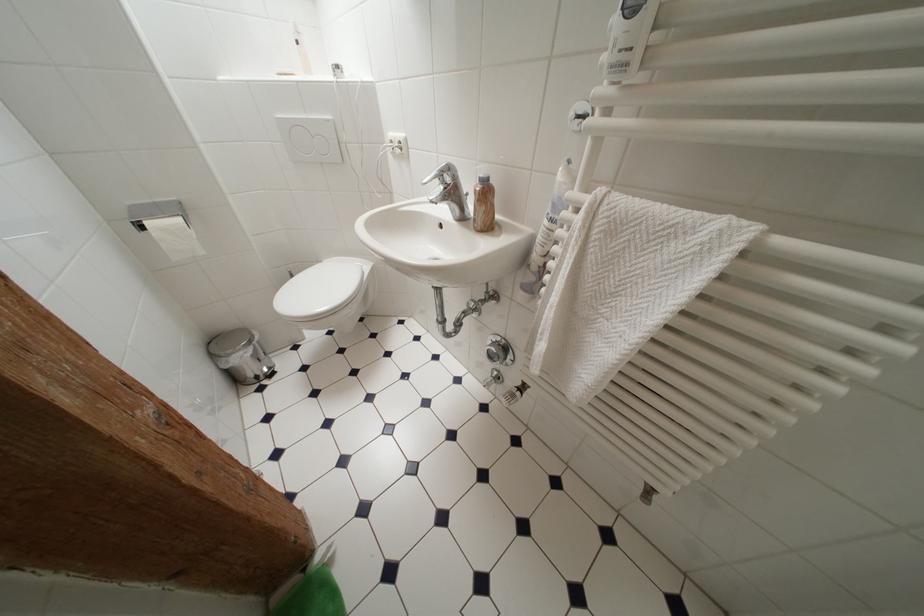
What do you see at coordinates (448, 191) in the screenshot?
I see `the chrome faucet handle` at bounding box center [448, 191].